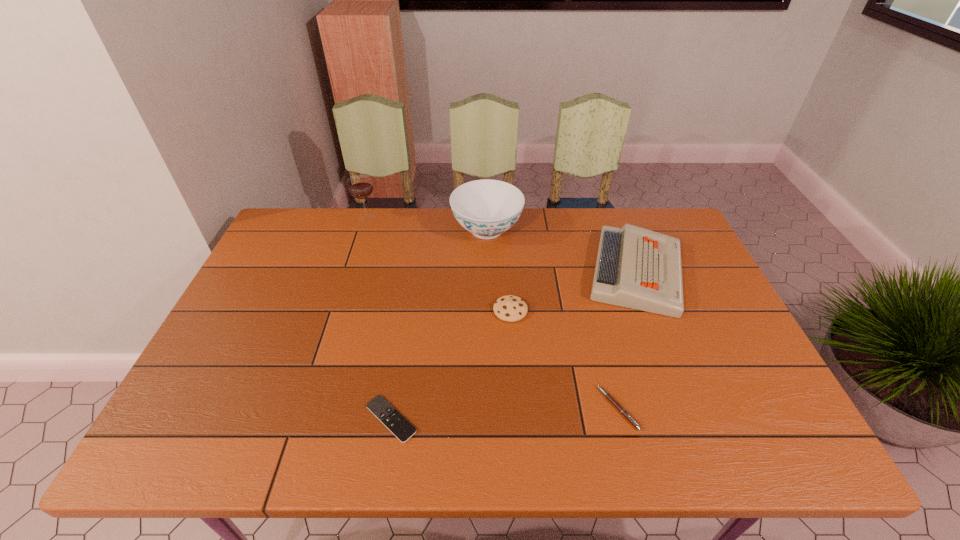
Locate an element on the screen. remote control at the near edge is located at coordinates (380, 407).

At what (x,y) coordinates should I click in order to perform the action: click on object situated at the right edge. Please return your answer as a coordinate pair (x, y). This screenshot has height=540, width=960. Looking at the image, I should click on (637, 268).

Find the location of a particular element. The width and height of the screenshot is (960, 540). object that is positioned at the far right corner is located at coordinates (637, 268).

Find the location of `free spot at the far edge of the desktop`. free spot at the far edge of the desktop is located at coordinates (389, 239).

In the image, there is a desktop. What are the coordinates of `free space at the left edge` in the screenshot? It's located at (265, 264).

I want to click on free location at the right edge of the desktop, so click(688, 278).

In the image, there is a desktop. Where is `vacant space at the far left corner`? The height and width of the screenshot is (540, 960). vacant space at the far left corner is located at coordinates (321, 227).

In the image, there is a desktop. Identify the location of blank space at the near left corner. The width and height of the screenshot is (960, 540). (231, 426).

I want to click on vacant space at the far right corner of the desktop, so click(682, 247).

Where is `vacant space at the near right corner of the desktop`? This screenshot has height=540, width=960. vacant space at the near right corner of the desktop is located at coordinates (780, 446).